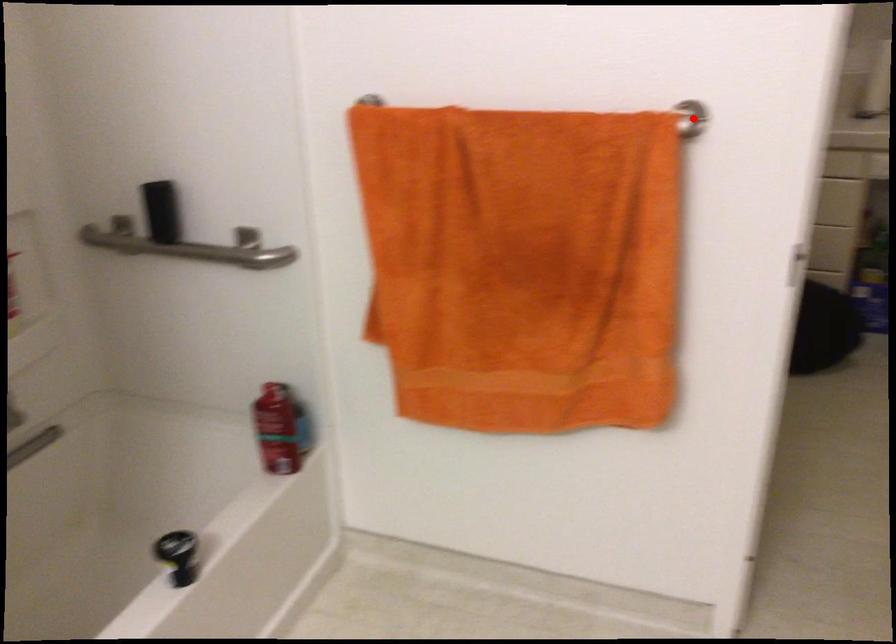
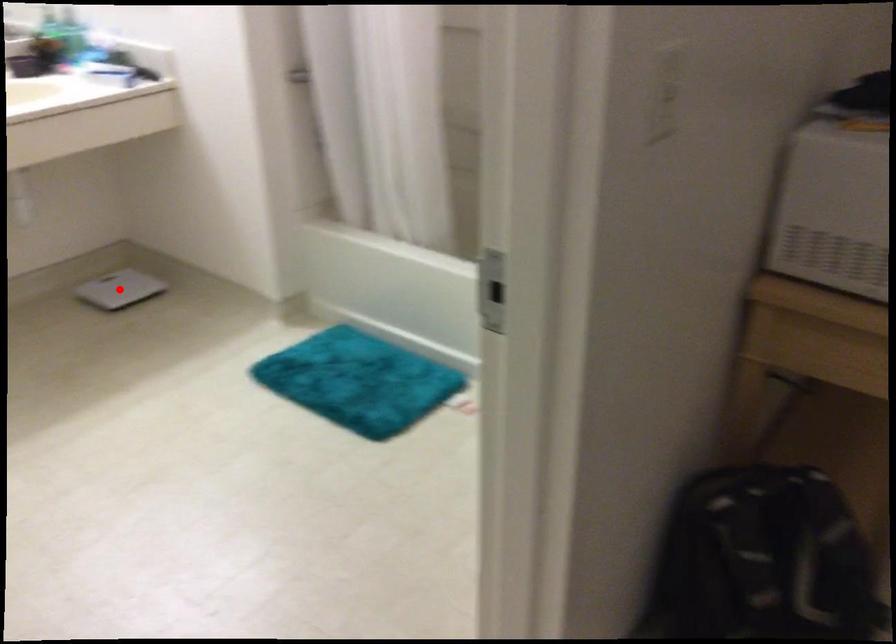
I am providing you with two images of the same scene from different viewpoints. A red point is marked on the first image and another point is marked on the second image. Are the points marked in image1 and image2 representing the same 3D position?

No